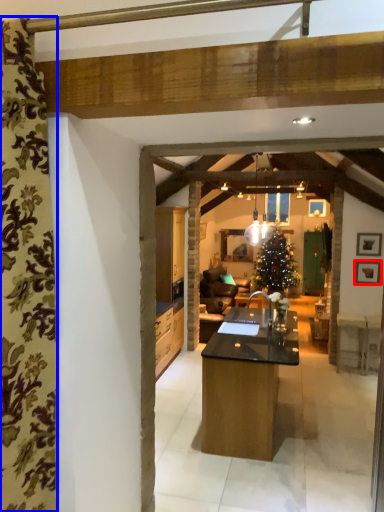
Question: Which of the following is the farthest to the observer, picture frame (highlighted by a red box) or curtain (highlighted by a blue box)?

Choices:
 (A) picture frame
 (B) curtain

Answer: (A)